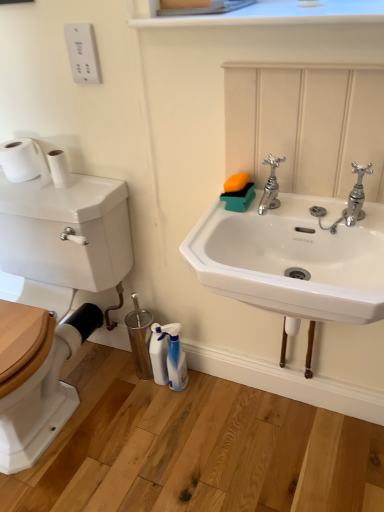
Question: In which direction should I rotate to look at chrome metallic faucet at upper center, the second tap viewed from the right?

Choices:
 (A) right
 (B) left

Answer: (A)

Question: Is chrome metallic faucet at upper right, which appears as the second tap when viewed from the left, taller than white matte toilet paper at left, which is counted as the 2th toilet paper, starting from the right?

Choices:
 (A) yes
 (B) no

Answer: (A)

Question: Could white matte toilet paper at left, the 1th toilet paper viewed from the left, be considered to be inside chrome metallic faucet at upper right, which ranks as the first tap in right-to-left order?

Choices:
 (A) no
 (B) yes

Answer: (A)

Question: From the image's perspective, is chrome metallic faucet at upper right, which appears as the second tap when viewed from the left, below white matte toilet paper at left, the 1th toilet paper viewed from the left?

Choices:
 (A) no
 (B) yes

Answer: (B)

Question: Is chrome metallic faucet at upper right, which ranks as the first tap in right-to-left order, turned away from white matte toilet paper at left, which is counted as the 2th toilet paper, starting from the right?

Choices:
 (A) yes
 (B) no

Answer: (B)

Question: Is chrome metallic faucet at upper right, which appears as the second tap when viewed from the left, not within white matte toilet paper at left, the 1th toilet paper viewed from the left?

Choices:
 (A) yes
 (B) no

Answer: (A)

Question: Does chrome metallic faucet at upper right, which appears as the second tap when viewed from the left, have a smaller size compared to white matte toilet paper at left, which is counted as the 2th toilet paper, starting from the right?

Choices:
 (A) no
 (B) yes

Answer: (B)

Question: Can you confirm if chrome metallic faucet at upper center, the second tap viewed from the right, is shorter than white plastic spray bottle at lower center, arranged as the 2th cleaning product when viewed from the right?

Choices:
 (A) no
 (B) yes

Answer: (B)

Question: Is chrome metallic faucet at upper center, the first tap when ordered from left to right, aimed at white plastic spray bottle at lower center, arranged as the 2th cleaning product when viewed from the right?

Choices:
 (A) yes
 (B) no

Answer: (B)

Question: Considering the relative positions of chrome metallic faucet at upper center, the first tap when ordered from left to right, and white plastic spray bottle at lower center, which ranks as the first cleaning product in left-to-right order, in the image provided, is chrome metallic faucet at upper center, the first tap when ordered from left to right, to the left of white plastic spray bottle at lower center, which ranks as the first cleaning product in left-to-right order, from the viewer's perspective?

Choices:
 (A) no
 (B) yes

Answer: (A)

Question: Are chrome metallic faucet at upper center, the first tap when ordered from left to right, and white plastic spray bottle at lower center, arranged as the 2th cleaning product when viewed from the right, making contact?

Choices:
 (A) yes
 (B) no

Answer: (B)

Question: Considering the relative sizes of chrome metallic faucet at upper center, the first tap when ordered from left to right, and white plastic spray bottle at lower center, arranged as the 2th cleaning product when viewed from the right, in the image provided, is chrome metallic faucet at upper center, the first tap when ordered from left to right, bigger than white plastic spray bottle at lower center, arranged as the 2th cleaning product when viewed from the right,?

Choices:
 (A) yes
 (B) no

Answer: (B)

Question: Can you confirm if chrome metallic faucet at upper center, the second tap viewed from the right, is thinner than white plastic spray bottle at lower center, arranged as the 2th cleaning product when viewed from the right?

Choices:
 (A) no
 (B) yes

Answer: (A)

Question: Is white smooth window sill at upper center oriented towards chrome metallic faucet at upper right, which appears as the second tap when viewed from the left?

Choices:
 (A) no
 (B) yes

Answer: (A)